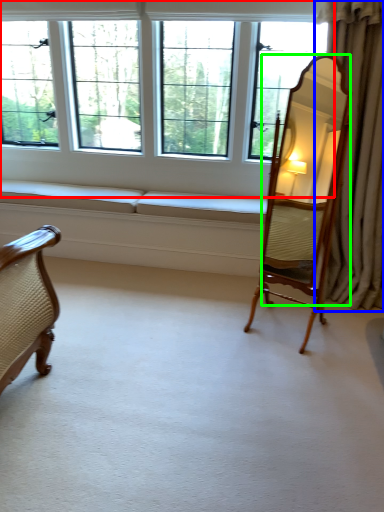
Question: Which object is the closest to the window (highlighted by a red box)? Choose among these: curtain (highlighted by a blue box) or mirror (highlighted by a green box).

Choices:
 (A) curtain
 (B) mirror

Answer: (B)